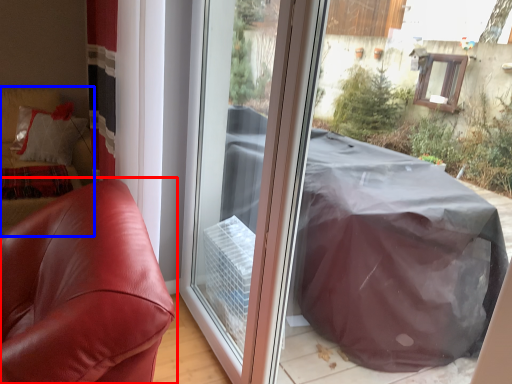
Question: Among these objects, which one is nearest to the camera, furniture (highlighted by a red box) or couch (highlighted by a blue box)?

Choices:
 (A) furniture
 (B) couch

Answer: (A)